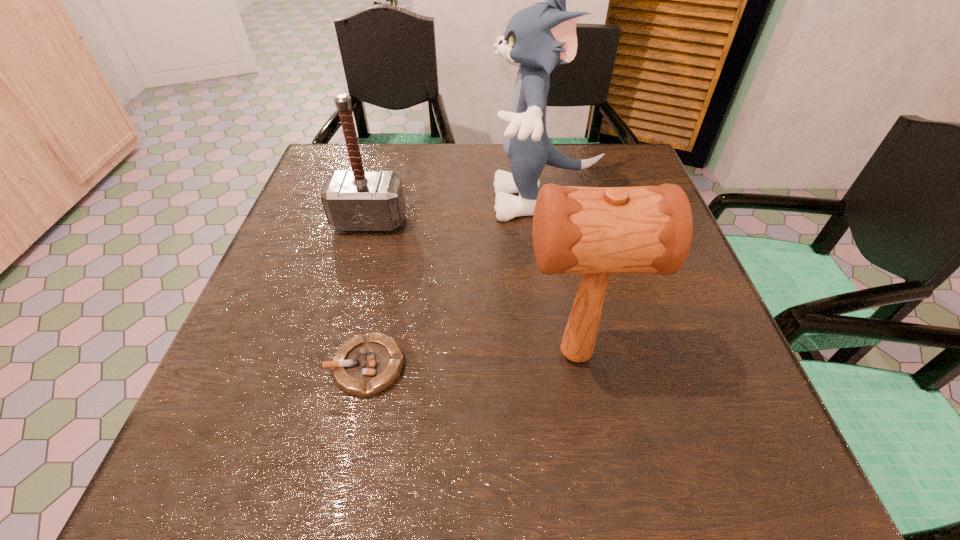
You are a GUI agent. You are given a task and a screenshot of the screen. Output one action in this format:
    pyautogui.click(x=<x>, y=<y>)
    Task: Click on the free spot at the far left corner of the desktop
    
    Given the screenshot: What is the action you would take?
    pyautogui.click(x=382, y=144)

The width and height of the screenshot is (960, 540). I want to click on free space at the near left corner of the desktop, so click(x=238, y=441).

Find the location of `vacant space at the far right corner of the desktop`. vacant space at the far right corner of the desktop is located at coordinates (598, 182).

You are a GUI agent. You are given a task and a screenshot of the screen. Output one action in this format:
    pyautogui.click(x=<x>, y=<y>)
    Task: Click on the unoccupied area between the hammer and the ashtray
    Image resolution: width=960 pixels, height=540 pixels.
    Given the screenshot: What is the action you would take?
    click(368, 294)

At what (x,y) coordinates should I click in order to perform the action: click on free spot between the cat and the mallet. Please return your answer as a coordinate pair (x, y). Image resolution: width=960 pixels, height=540 pixels. Looking at the image, I should click on (559, 277).

Locate an element on the screen. free space between the ashtray and the mallet is located at coordinates (470, 360).

The width and height of the screenshot is (960, 540). In order to click on free space that is in between the tallest object and the hammer in this screenshot , I will do `click(456, 211)`.

Identify the location of free space between the shortest object and the mallet. This screenshot has width=960, height=540. (470, 360).

Locate an element on the screen. The image size is (960, 540). blank region between the hammer and the mallet is located at coordinates (472, 288).

Where is `blank region between the mallet and the hammer`? blank region between the mallet and the hammer is located at coordinates (472, 288).